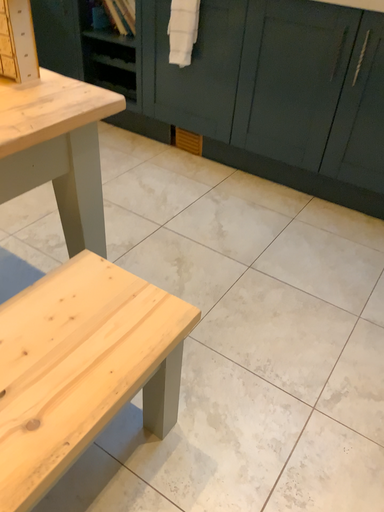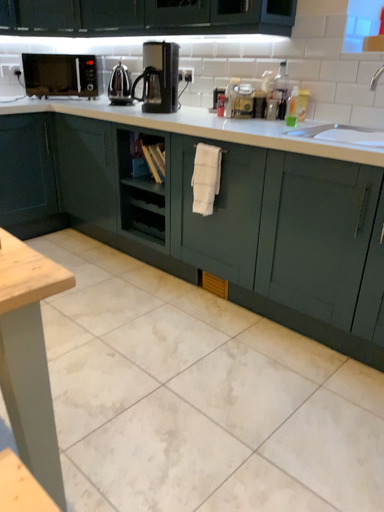
Question: Which way did the camera rotate in the video?

Choices:
 (A) rotated upward
 (B) rotated downward

Answer: (A)